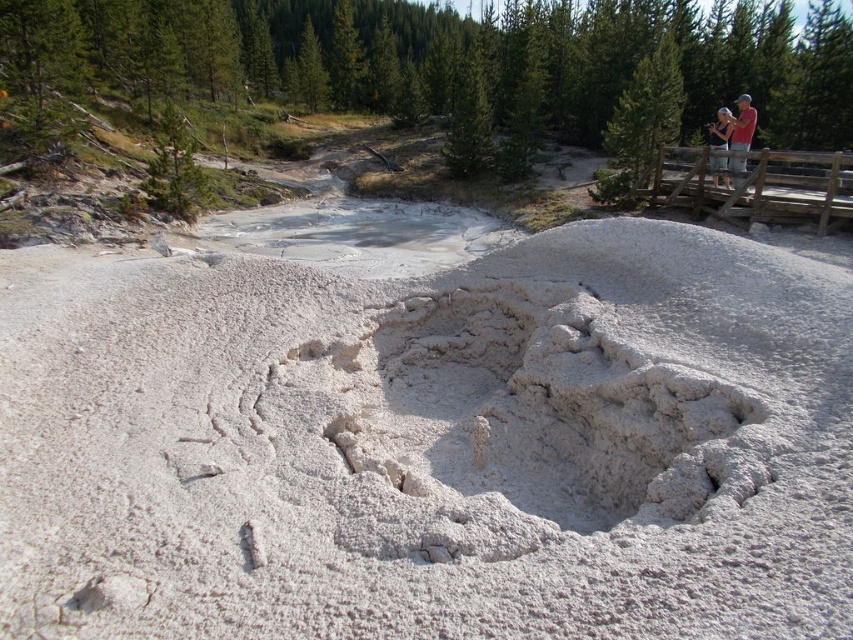
Is the position of white powdery mound at center less distant than that of red shirt at upper right?

Yes, white powdery mound at center is closer to the viewer.

What are the coordinates of `white powdery mound at center` in the screenshot? It's located at point(440,449).

Is red shirt at upper right further to camera compared to light blue denim shirt at upper right?

No, it is in front of light blue denim shirt at upper right.

The width and height of the screenshot is (853, 640). What do you see at coordinates (740, 138) in the screenshot? I see `red shirt at upper right` at bounding box center [740, 138].

Identify the location of red shirt at upper right. The height and width of the screenshot is (640, 853). (740, 138).

Is white powdery mound at center positioned at the back of light blue denim shirt at upper right?

That is False.

Is white powdery mound at center positioned before light blue denim shirt at upper right?

Yes.

Locate an element on the screen. The image size is (853, 640). white powdery mound at center is located at coordinates (440, 449).